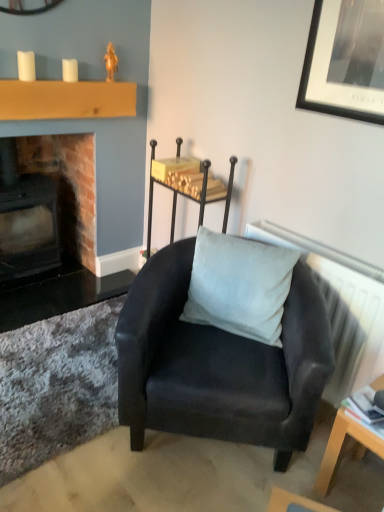
Question: From a real-world perspective, does white textured radiator at upper right sit lower than satin black chair at center?

Choices:
 (A) yes
 (B) no

Answer: (A)

Question: Does white textured radiator at upper right appear on the left side of satin black chair at center?

Choices:
 (A) yes
 (B) no

Answer: (B)

Question: Considering the relative sizes of white textured radiator at upper right and satin black chair at center in the image provided, is white textured radiator at upper right taller than satin black chair at center?

Choices:
 (A) yes
 (B) no

Answer: (B)

Question: Is satin black chair at center located within white textured radiator at upper right?

Choices:
 (A) yes
 (B) no

Answer: (B)

Question: Are white textured radiator at upper right and satin black chair at center making contact?

Choices:
 (A) yes
 (B) no

Answer: (B)

Question: Would you say white textured radiator at upper right is outside satin black chair at center?

Choices:
 (A) no
 (B) yes

Answer: (B)

Question: Does matte black armchair at center appear on the left side of brick fireplace at left?

Choices:
 (A) no
 (B) yes

Answer: (A)

Question: Considering the relative sizes of matte black armchair at center and brick fireplace at left in the image provided, is matte black armchair at center thinner than brick fireplace at left?

Choices:
 (A) no
 (B) yes

Answer: (A)

Question: From the image's perspective, is matte black armchair at center located beneath brick fireplace at left?

Choices:
 (A) no
 (B) yes

Answer: (B)

Question: Is matte black armchair at center directly adjacent to brick fireplace at left?

Choices:
 (A) no
 (B) yes

Answer: (A)

Question: Considering the relative sizes of matte black armchair at center and brick fireplace at left in the image provided, is matte black armchair at center smaller than brick fireplace at left?

Choices:
 (A) yes
 (B) no

Answer: (B)

Question: Is matte black armchair at center oriented away from brick fireplace at left?

Choices:
 (A) no
 (B) yes

Answer: (A)

Question: Is brick fireplace at left completely or partially inside white textured radiator at upper right?

Choices:
 (A) no
 (B) yes

Answer: (A)